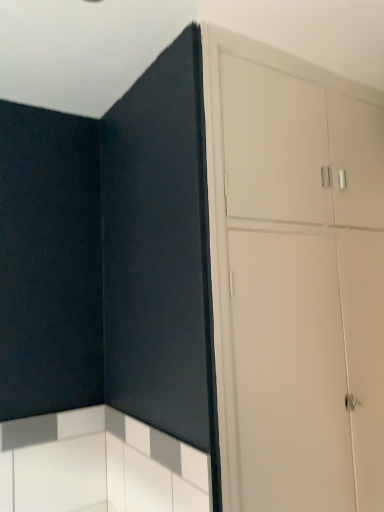
Locate an element on the screen. Image resolution: width=384 pixels, height=512 pixels. matte white cupboard at center is located at coordinates (295, 278).

The image size is (384, 512). What do you see at coordinates (295, 278) in the screenshot?
I see `matte white cupboard at center` at bounding box center [295, 278].

Find the location of `matte white cupboard at center`. matte white cupboard at center is located at coordinates (295, 278).